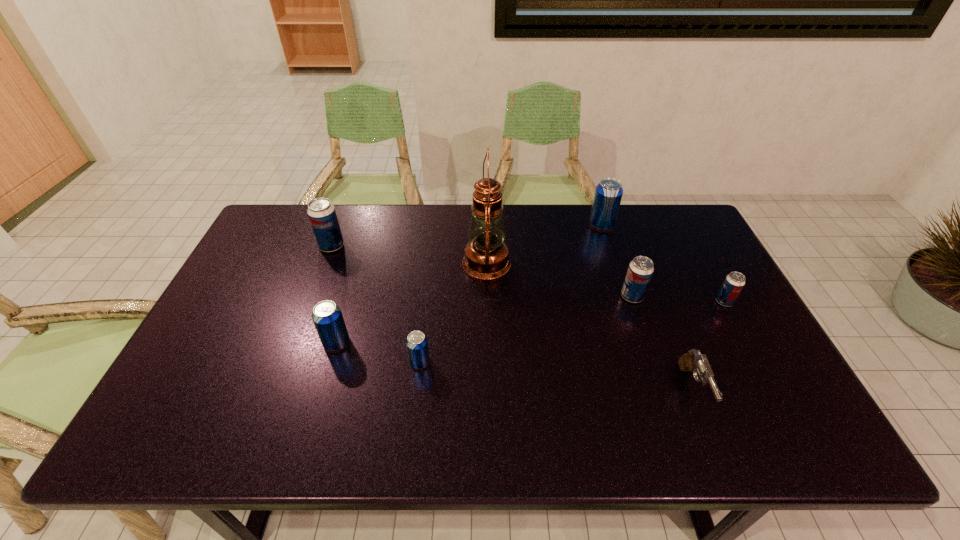
Find the location of a particular element. This screenshot has height=540, width=960. vacant point located between the rightmost beer can and the second smallest blue beer can is located at coordinates (530, 322).

Locate an element on the screen. blank region between the pistol and the fourth beer can from right to left is located at coordinates (556, 376).

Where is `empty location between the leftmost red beer can and the fourth object from left to right`? This screenshot has width=960, height=540. empty location between the leftmost red beer can and the fourth object from left to right is located at coordinates (409, 254).

Find the location of `vacant area that lies between the second object from right to left and the second nearest blue beer can`. vacant area that lies between the second object from right to left and the second nearest blue beer can is located at coordinates (515, 366).

This screenshot has width=960, height=540. Find the location of `free spot between the second farthest blue beer can and the gray pistol`. free spot between the second farthest blue beer can and the gray pistol is located at coordinates (515, 366).

Locate an element on the screen. vacant space that's between the oil lamp and the leftmost blue beer can is located at coordinates (412, 302).

The width and height of the screenshot is (960, 540). Find the location of `free spot between the leftmost blue beer can and the second blue beer can from left to right`. free spot between the leftmost blue beer can and the second blue beer can from left to right is located at coordinates (378, 352).

Identify the location of the seventh closest object to the second farthest beer can. (734, 282).

Locate an element on the screen. the third closest object to the third nearest object is located at coordinates (486, 257).

Select which beer can is the sixth closest to the oil lamp. Please provide its 2D coordinates. Your answer should be formatted as a tuple, i.e. [(x, y)], where the tuple contains the x and y coordinates of a point satisfying the conditions above.

[(734, 282)]